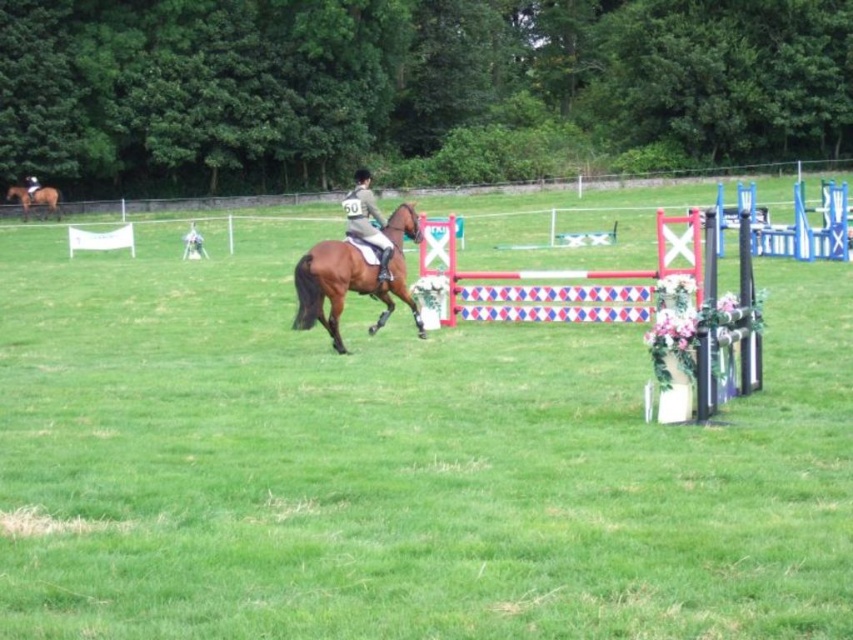
Does brown glossy horse at center have a larger size compared to brown glossy horse at upper left?

Yes, brown glossy horse at center is bigger than brown glossy horse at upper left.

Does brown glossy horse at center have a greater height compared to brown glossy horse at upper left?

Indeed, brown glossy horse at center has a greater height compared to brown glossy horse at upper left.

Find the location of a particular element. brown glossy horse at center is located at coordinates (352, 276).

The image size is (853, 640). I want to click on brown glossy horse at center, so (x=352, y=276).

Is brown glossy horse at upper left shorter than dark brown leather jacket at center?

Correct, brown glossy horse at upper left is not as tall as dark brown leather jacket at center.

Between brown glossy horse at upper left and dark brown leather jacket at center, which one has more height?

With more height is dark brown leather jacket at center.

Locate an element on the screen. brown glossy horse at upper left is located at coordinates (35, 198).

Who is more forward, (309,305) or (32,184)?

Point (309,305) is more forward.

Consider the image. Does brown glossy horse at center have a greater height compared to dark brown leather jacket at center?

Yes, brown glossy horse at center is taller than dark brown leather jacket at center.

The image size is (853, 640). What do you see at coordinates (352, 276) in the screenshot?
I see `brown glossy horse at center` at bounding box center [352, 276].

What are the coordinates of `brown glossy horse at center` in the screenshot? It's located at (352, 276).